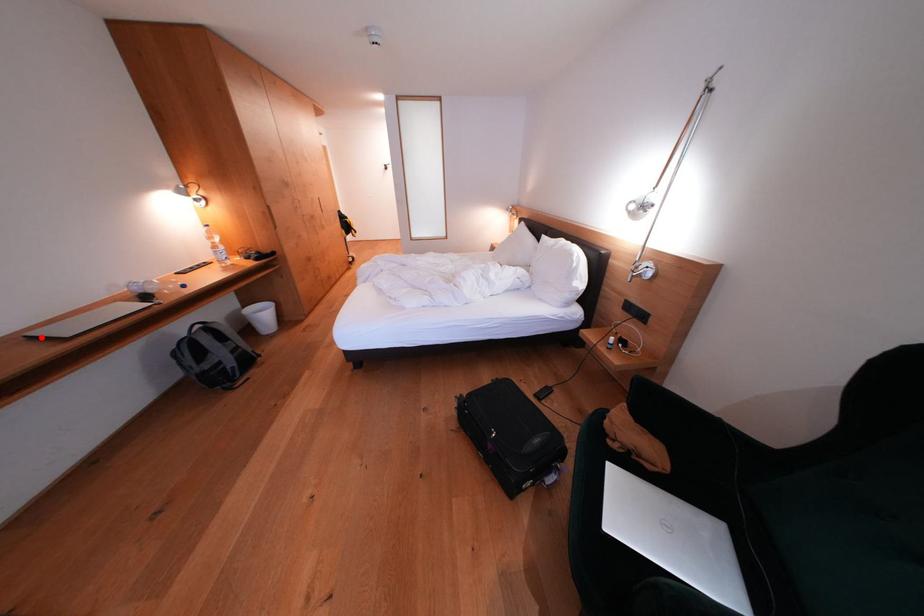
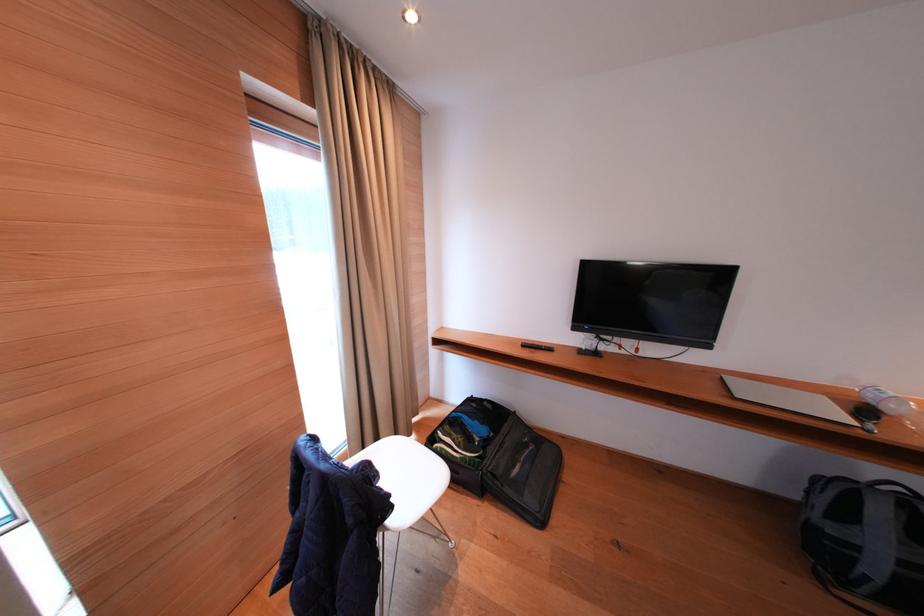
Question: A red point is marked in image1. In image2, is the corresponding 3D point closer to the camera or farther? Reply with the corresponding letter.

Choices:
 (A) The corresponding 3D point is closer.
 (B) The corresponding 3D point is farther.

Answer: (A)